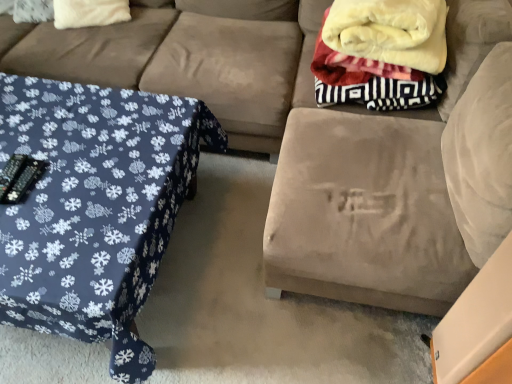
Describe the element at coordinates (185, 60) in the screenshot. I see `suede couch at upper left` at that location.

Where is `soft fleece blanket at upper right`? soft fleece blanket at upper right is located at coordinates (380, 50).

Describe the element at coordinates (89, 13) in the screenshot. I see `white fluffy pillow at upper left` at that location.

At what (x,y) coordinates should I click in order to perform the action: click on white fluffy pillow at upper left. Please return your answer as a coordinate pair (x, y). The width and height of the screenshot is (512, 384). Looking at the image, I should click on click(89, 13).

Locate an element on the screen. suede couch at upper left is located at coordinates (185, 60).

From the image's perspective, is white fluffy pillow at upper left under suede ottoman at center?

No.

Is white fluffy pillow at upper left placed right next to suede ottoman at center?

No, white fluffy pillow at upper left is not touching suede ottoman at center.

Considering the sizes of objects white fluffy pillow at upper left and suede ottoman at center in the image provided, who is bigger, white fluffy pillow at upper left or suede ottoman at center?

Bigger between the two is suede ottoman at center.

Do you think white fluffy pillow at upper left is within suede ottoman at center, or outside of it?

white fluffy pillow at upper left is not inside suede ottoman at center, it's outside.

At what (x,y) coordinates should I click in order to perform the action: click on the footrest that appears in front of the blue fabric table at left. Please return your answer as a coordinate pair (x, y). This screenshot has width=512, height=384. Looking at the image, I should click on (364, 213).

Who is bigger, suede ottoman at center or blue fabric table at left?

suede ottoman at center.

From a real-world perspective, relative to blue fabric table at left, is suede ottoman at center vertically above or below?

In terms of real-world spatial position, suede ottoman at center is above blue fabric table at left.

Between suede ottoman at center and blue fabric table at left, which one appears on the right side from the viewer's perspective?

From the viewer's perspective, suede ottoman at center appears more on the right side.

Which of these two, suede couch at upper left or blue fabric table at left, is thinner?

suede couch at upper left.

Could you tell me if suede couch at upper left is facing blue fabric table at left?

Yes, suede couch at upper left is turned towards blue fabric table at left.

Is suede couch at upper left taller than blue fabric table at left?

Yes.

Would you say blue fabric table at left is a long distance from suede ottoman at center?

Actually, blue fabric table at left and suede ottoman at center are a little close together.

Considering the sizes of objects blue fabric table at left and suede ottoman at center in the image provided, who is smaller, blue fabric table at left or suede ottoman at center?

blue fabric table at left is smaller.

Does blue fabric table at left contain suede ottoman at center?

Definitely not — suede ottoman at center is not inside blue fabric table at left.

This screenshot has height=384, width=512. Identify the location of footrest on the right of blue fabric table at left. (364, 213).

Is suede ottoman at center outside of soft fleece blanket at upper right?

Yes.

Is suede ottoman at center beside soft fleece blanket at upper right?

suede ottoman at center and soft fleece blanket at upper right are not in contact.

Is suede ottoman at center looking in the opposite direction of soft fleece blanket at upper right?

Yes, suede ottoman at center is facing away from soft fleece blanket at upper right.

Is the depth of suede ottoman at center greater than that of soft fleece blanket at upper right?

No, it is not.

Considering the relative sizes of soft fleece blanket at upper right and suede couch at upper left in the image provided, is soft fleece blanket at upper right shorter than suede couch at upper left?

Yes.

Is soft fleece blanket at upper right positioned far away from suede couch at upper left?

No, soft fleece blanket at upper right is not far away from suede couch at upper left.

Considering the relative positions of soft fleece blanket at upper right and suede couch at upper left in the image provided, is soft fleece blanket at upper right in front of suede couch at upper left?

Yes.

Is suede couch at upper left spatially inside white fluffy pillow at upper left, or outside of it?

suede couch at upper left is spatially situated outside white fluffy pillow at upper left.

Where is `throw pillow above the suede couch at upper left (from the image's perspective)`? The image size is (512, 384). throw pillow above the suede couch at upper left (from the image's perspective) is located at coordinates (89, 13).

Are suede couch at upper left and white fluffy pillow at upper left far apart?

No, there isn't a large distance between suede couch at upper left and white fluffy pillow at upper left.

From a real-world perspective, is suede couch at upper left on white fluffy pillow at upper left?

No.

What are the coordinates of `footrest below the white fluffy pillow at upper left (from a real-world perspective)` in the screenshot? It's located at (364, 213).

Locate an element on the screen. the footrest located in front of the blue fabric table at left is located at coordinates (364, 213).

Looking at the image, which one is located closer to white fluffy pillow at upper left, soft fleece blanket at upper right or suede ottoman at center?

soft fleece blanket at upper right.

Considering their positions, is suede couch at upper left positioned further to blue fabric table at left than soft fleece blanket at upper right?

soft fleece blanket at upper right is further to blue fabric table at left.

From the image, which object appears to be nearer to blue fabric table at left, white fluffy pillow at upper left or suede ottoman at center?

The object closer to blue fabric table at left is suede ottoman at center.

Looking at the image, which one is located closer to suede ottoman at center, blue fabric table at left or suede couch at upper left?

The object closer to suede ottoman at center is blue fabric table at left.

Looking at the image, which one is located further to white fluffy pillow at upper left, suede couch at upper left or soft fleece blanket at upper right?

The object further to white fluffy pillow at upper left is soft fleece blanket at upper right.

From the image, which object appears to be farther from soft fleece blanket at upper right, blue fabric table at left or suede ottoman at center?

Based on the image, blue fabric table at left appears to be further to soft fleece blanket at upper right.

From the image, which object appears to be nearer to soft fleece blanket at upper right, suede ottoman at center or white fluffy pillow at upper left?

suede ottoman at center is closer to soft fleece blanket at upper right.

Based on their spatial positions, is blue fabric table at left or soft fleece blanket at upper right closer to suede couch at upper left?

blue fabric table at left is closer to suede couch at upper left.

The width and height of the screenshot is (512, 384). Identify the location of couch situated between white fluffy pillow at upper left and soft fleece blanket at upper right from left to right. (185, 60).

Locate an element on the screen. blanket between white fluffy pillow at upper left and suede ottoman at center from left to right is located at coordinates pyautogui.click(x=380, y=50).

You are a GUI agent. You are given a task and a screenshot of the screen. Output one action in this format:
    pyautogui.click(x=<x>, y=<y>)
    Task: Click on the couch located between white fluffy pillow at upper left and suede ottoman at center in the left-right direction
    
    Given the screenshot: What is the action you would take?
    click(x=185, y=60)

Where is `table between white fluffy pillow at upper left and soft fleece blanket at upper right`? The height and width of the screenshot is (384, 512). table between white fluffy pillow at upper left and soft fleece blanket at upper right is located at coordinates (94, 207).